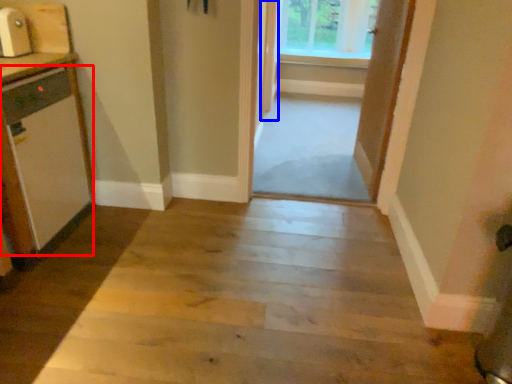
Question: Among these objects, which one is farthest to the camera, appliance (highlighted by a red box) or door (highlighted by a blue box)?

Choices:
 (A) appliance
 (B) door

Answer: (B)